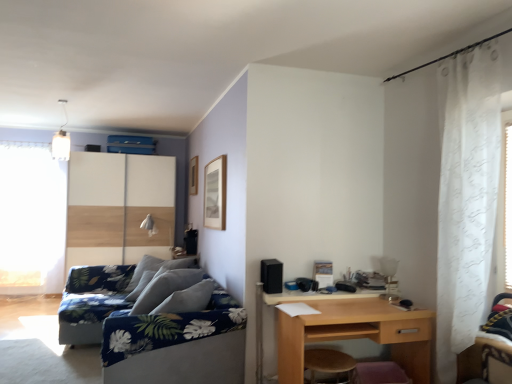
Question: From the image's perspective, does blue floral fabric couch at lower left appear lower than wooden sliding door at left?

Choices:
 (A) no
 (B) yes

Answer: (B)

Question: Could you tell me if blue floral fabric couch at lower left is facing wooden sliding door at left?

Choices:
 (A) yes
 (B) no

Answer: (B)

Question: Considering the relative sizes of blue floral fabric couch at lower left and wooden sliding door at left in the image provided, is blue floral fabric couch at lower left shorter than wooden sliding door at left?

Choices:
 (A) no
 (B) yes

Answer: (B)

Question: Can you confirm if blue floral fabric couch at lower left is positioned to the left of wooden sliding door at left?

Choices:
 (A) no
 (B) yes

Answer: (A)

Question: From a real-world perspective, does blue floral fabric couch at lower left sit lower than wooden sliding door at left?

Choices:
 (A) no
 (B) yes

Answer: (B)

Question: Considering the positions of wooden stool at lower center and light brown wood desk at lower right in the image, is wooden stool at lower center wider or thinner than light brown wood desk at lower right?

Choices:
 (A) wide
 (B) thin

Answer: (B)

Question: Do you think wooden stool at lower center is within light brown wood desk at lower right, or outside of it?

Choices:
 (A) inside
 (B) outside

Answer: (A)

Question: Is point (343, 360) positioned closer to the camera than point (286, 337)?

Choices:
 (A) farther
 (B) closer

Answer: (B)

Question: Considering the relative positions of wooden stool at lower center and light brown wood desk at lower right in the image provided, is wooden stool at lower center to the left or to the right of light brown wood desk at lower right?

Choices:
 (A) left
 (B) right

Answer: (A)

Question: From their relative heights in the image, would you say blue floral fabric couch at lower left is taller or shorter than light brown wood desk at lower right?

Choices:
 (A) tall
 (B) short

Answer: (A)

Question: Based on their positions, is blue floral fabric couch at lower left located to the left or right of light brown wood desk at lower right?

Choices:
 (A) left
 (B) right

Answer: (A)

Question: In the image, is blue floral fabric couch at lower left positioned in front of or behind light brown wood desk at lower right?

Choices:
 (A) front
 (B) behind

Answer: (B)

Question: Is point (236, 369) closer or farther from the camera than point (404, 359)?

Choices:
 (A) closer
 (B) farther

Answer: (B)

Question: Looking at their shapes, would you say white sheer curtain at left is wider or thinner than wooden sliding door at left?

Choices:
 (A) thin
 (B) wide

Answer: (A)

Question: From a real-world perspective, is white sheer curtain at left positioned above or below wooden sliding door at left?

Choices:
 (A) below
 (B) above

Answer: (B)